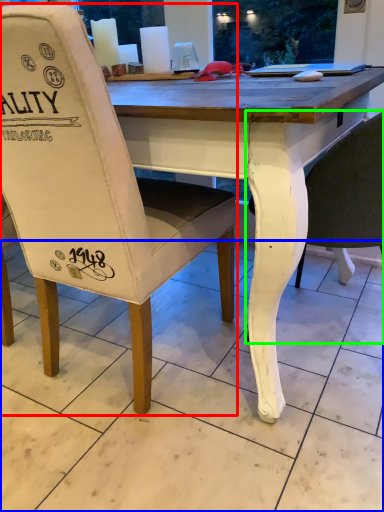
Question: Based on their relative distances, which object is nearer to chair (highlighted by a red box)? Choose from tile (highlighted by a blue box) and chair (highlighted by a green box).

Choices:
 (A) tile
 (B) chair

Answer: (A)